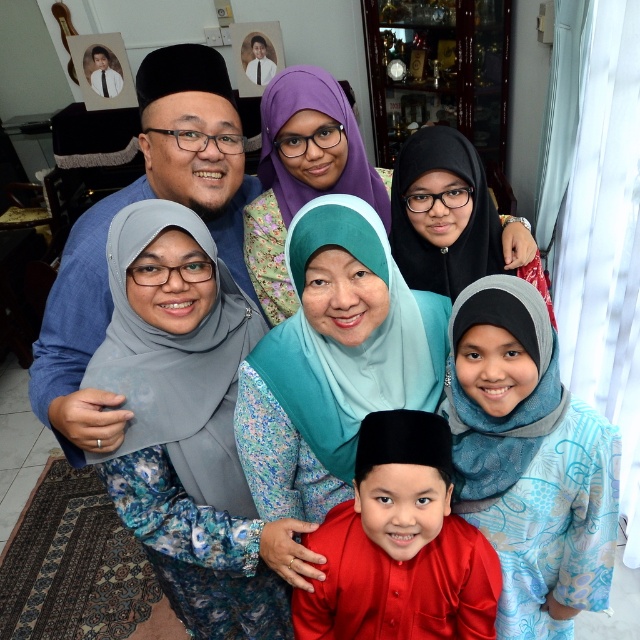
Is point (326, 152) more distant than point (428, 156)?

That is True.

Who is positioned more to the right, purple satin hijab at center or black satin hijab at upper right?

black satin hijab at upper right is more to the right.

Where is `purple satin hijab at center`? purple satin hijab at center is located at coordinates (301, 173).

You are a GUI agent. You are given a task and a screenshot of the screen. Output one action in this format:
    pyautogui.click(x=<x>, y=<y>)
    Task: Click on the purple satin hijab at center
    The height and width of the screenshot is (640, 640).
    Given the screenshot: What is the action you would take?
    pyautogui.click(x=301, y=173)

Which is in front, point (241, 314) or point (355, 198)?

Positioned in front is point (355, 198).

What are the coordinates of `matte gray hijab at center` in the screenshot? It's located at (184, 422).

Locate an element on the screen. matte gray hijab at center is located at coordinates (184, 422).

Does blue patterned hijab at center have a lesser width compared to silky red shirt at center?

Indeed, blue patterned hijab at center has a lesser width compared to silky red shirt at center.

Is blue patterned hijab at center positioned behind silky red shirt at center?

Yes.

I want to click on blue patterned hijab at center, so click(529, 460).